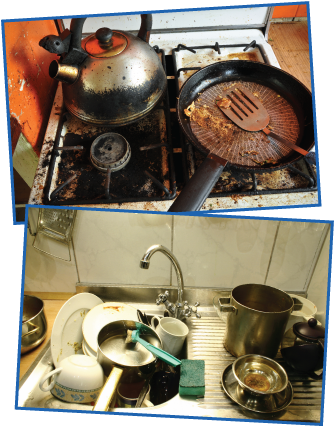
You are a GUI agent. You are given a task and a screenshot of the screen. Output one action in this format:
    pyautogui.click(x=<x>, y=<y>)
    Task: Click on the dirty frying pan
    
    Given the screenshot: What is the action you would take?
    pyautogui.click(x=247, y=136)